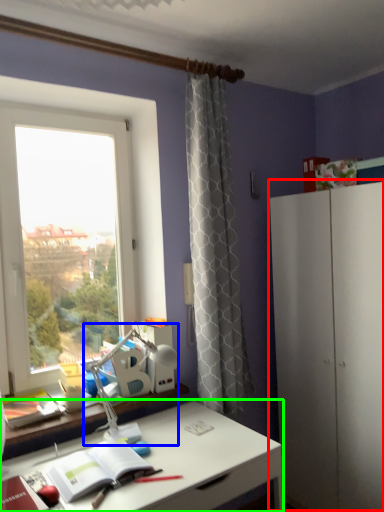
Question: Estimate the real-world distances between objects in this image. Which object is closer to dresser (highlighted by a red box), table lamp (highlighted by a blue box) or desk (highlighted by a green box)?

Choices:
 (A) table lamp
 (B) desk

Answer: (B)